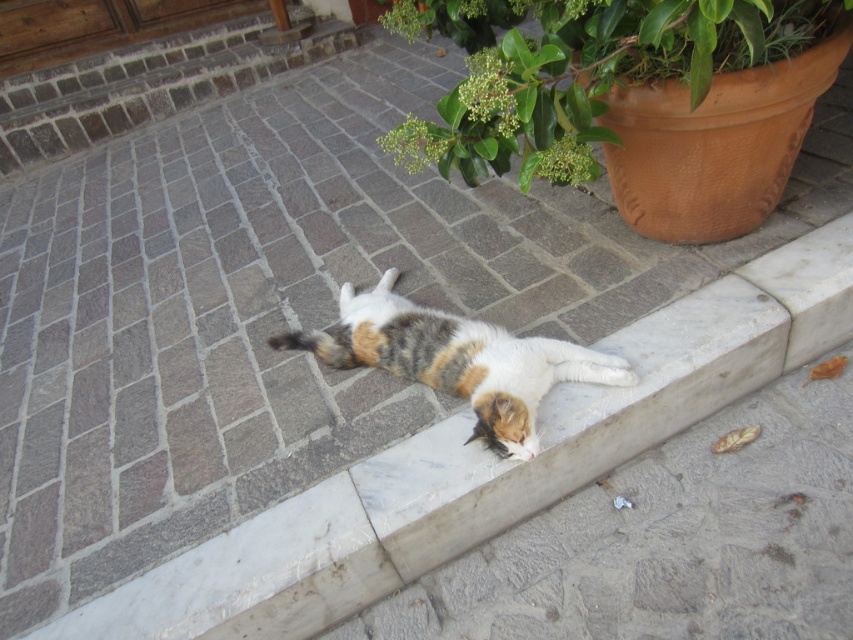
You are a gardener who needs to water the green leafy plant at upper center without disturbing the calico fur cat at center. If your watering can has a range of 50 centimeters, can you reach the plant from where you are standing next to the cat?

The distance between the green leafy plant at upper center and the calico fur cat at center is 54.58 centimeters. Since the watering can only reaches 50 centimeters, you cannot water the plant from next to the cat without moving closer.

You are a gardener who wants to move the calico fur cat at center to a safer spot away from the green leafy plant at upper center. Which direction should you move the cat to get it farther from the plant?

Move the calico fur cat at center to the left side, away from the green leafy plant at upper center, since the plant is located to the right of the cat.

You are a gardener looking at the scene. You need to water the green leafy plant at upper center and the calico fur cat at center. Which one is closer to your right side?

The green leafy plant at upper center is to the right of calico fur cat at center, so it is closer to your right side.